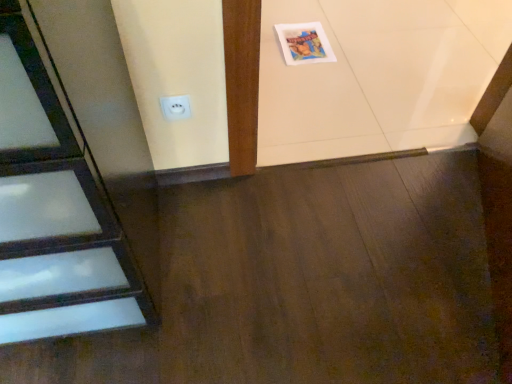
Locate an element on the screen. white glossy electric outlet at upper left is located at coordinates (175, 107).

Measure the distance between point (x=162, y=110) and camera.

The distance of point (x=162, y=110) from camera is 3.66 feet.

What do you see at coordinates (175, 107) in the screenshot? I see `white glossy electric outlet at upper left` at bounding box center [175, 107].

Where is `white glossy electric outlet at upper left`? This screenshot has height=384, width=512. white glossy electric outlet at upper left is located at coordinates [x=175, y=107].